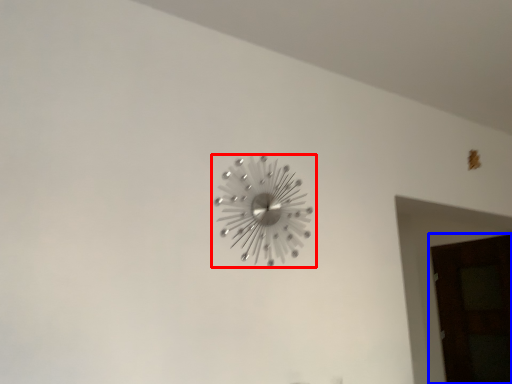
Question: Which object is further to the camera taking this photo, wall clock (highlighted by a red box) or door (highlighted by a blue box)?

Choices:
 (A) wall clock
 (B) door

Answer: (B)